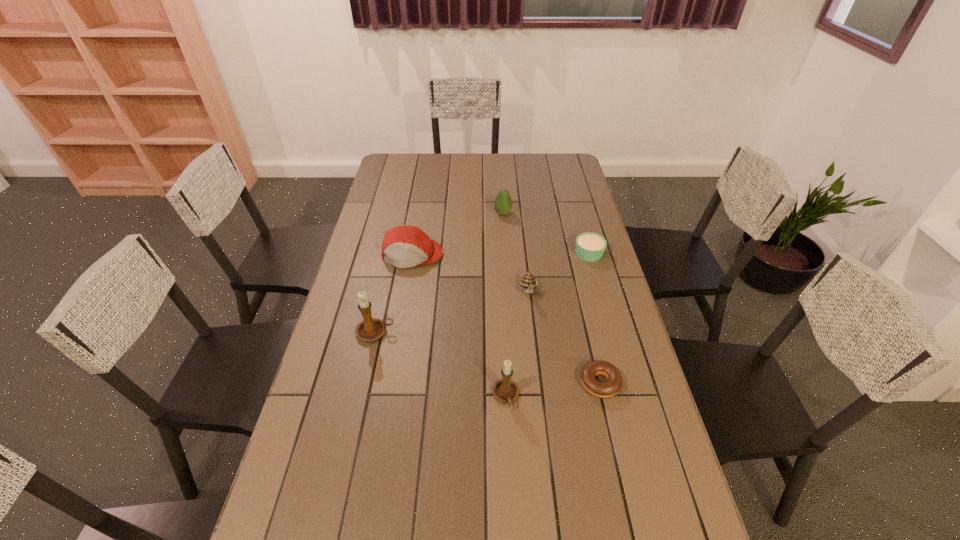
At what (x,y) coordinates should I click in order to perform the action: click on vacant area that satisfies the following two spatial constraints: 1. on the front-facing side of the cap; 2. on the side of the fifth farthest object with the handle. Please return your answer as a coordinate pair (x, y). The width and height of the screenshot is (960, 540). Looking at the image, I should click on (398, 332).